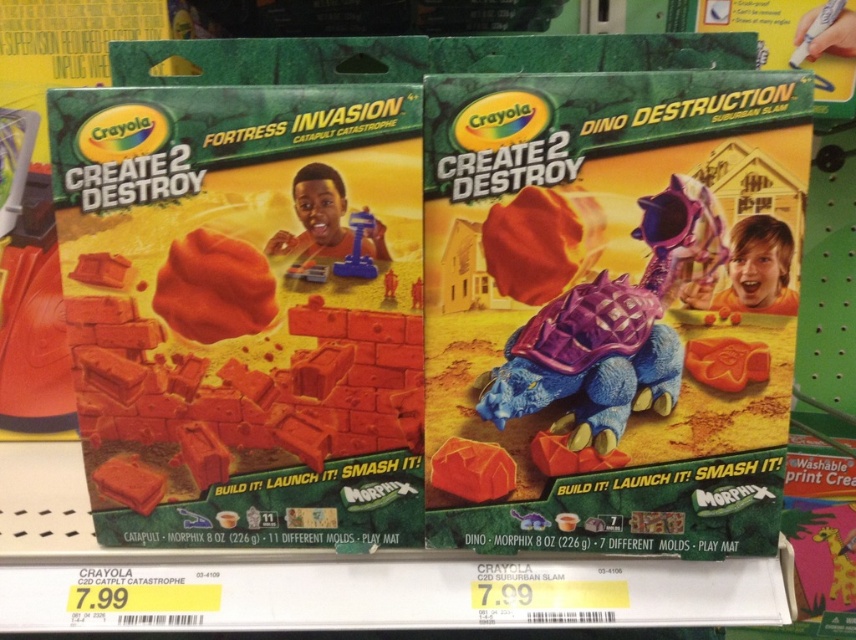
Image resolution: width=856 pixels, height=640 pixels. In order to click on purple matte dinosaur at center in this screenshot , I will do [590, 358].

Can you confirm if purple matte dinosaur at center is positioned above matte orange foam at center?

Incorrect, purple matte dinosaur at center is not positioned above matte orange foam at center.

Where is `purple matte dinosaur at center`? purple matte dinosaur at center is located at coordinates (590, 358).

The image size is (856, 640). What are the coordinates of `purple matte dinosaur at center` in the screenshot? It's located at (590, 358).

Can you confirm if purple matte dinosaur at center is smaller than matte orange rock at center?

No.

The image size is (856, 640). What do you see at coordinates (590, 358) in the screenshot?
I see `purple matte dinosaur at center` at bounding box center [590, 358].

In order to click on purple matte dinosaur at center in this screenshot , I will do `click(590, 358)`.

Locate an element on the screen. purple matte dinosaur at center is located at coordinates (590, 358).

At what (x,y) coordinates should I click in order to perform the action: click on orange rubber dinosaur at center. Please return your answer as a coordinate pair (x, y). Looking at the image, I should click on (726, 362).

In order to click on orange rubber dinosaur at center in this screenshot , I will do `click(726, 362)`.